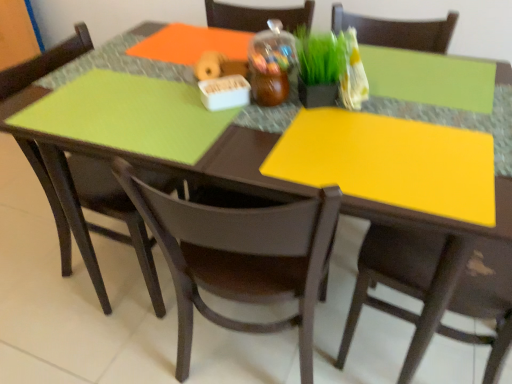
Question: Is matte brown chair at center, the second chair viewed from the right, outside matte black chair at right, acting as the 3th chair starting from the left?

Choices:
 (A) yes
 (B) no

Answer: (A)

Question: Does matte brown chair at center, the second chair viewed from the right, lie behind matte black chair at right, marked as the first chair in a right-to-left arrangement?

Choices:
 (A) no
 (B) yes

Answer: (B)

Question: From the image's perspective, is matte brown chair at center, placed as the 2th chair when sorted from left to right, on matte black chair at right, marked as the first chair in a right-to-left arrangement?

Choices:
 (A) no
 (B) yes

Answer: (B)

Question: Are matte brown chair at center, the second chair viewed from the right, and matte black chair at right, acting as the 3th chair starting from the left, far apart?

Choices:
 (A) no
 (B) yes

Answer: (A)

Question: Considering the relative sizes of matte brown chair at center, placed as the 2th chair when sorted from left to right, and matte black chair at right, acting as the 3th chair starting from the left, in the image provided, is matte brown chair at center, placed as the 2th chair when sorted from left to right, shorter than matte black chair at right, acting as the 3th chair starting from the left,?

Choices:
 (A) no
 (B) yes

Answer: (B)

Question: Is matte brown chair at center, placed as the 2th chair when sorted from left to right, bigger than matte black chair at right, marked as the first chair in a right-to-left arrangement?

Choices:
 (A) yes
 (B) no

Answer: (B)

Question: Is matte brown chair at center, the second chair viewed from the right, at the back of matte black chair at lower left, which is counted as the 3th chair, starting from the right?

Choices:
 (A) no
 (B) yes

Answer: (A)

Question: Can matte brown chair at center, placed as the 2th chair when sorted from left to right, be found inside matte black chair at lower left, which is counted as the 3th chair, starting from the right?

Choices:
 (A) no
 (B) yes

Answer: (A)

Question: Is matte black chair at lower left, which is counted as the 3th chair, starting from the right, positioned before matte brown chair at center, the second chair viewed from the right?

Choices:
 (A) no
 (B) yes

Answer: (A)

Question: From a real-world perspective, is matte black chair at lower left, which is counted as the 3th chair, starting from the right, beneath matte brown chair at center, the second chair viewed from the right?

Choices:
 (A) no
 (B) yes

Answer: (B)

Question: From the image's perspective, is matte black chair at lower left, which is counted as the 3th chair, starting from the right, on matte brown chair at center, the second chair viewed from the right?

Choices:
 (A) yes
 (B) no

Answer: (A)

Question: Can you confirm if matte black chair at right, marked as the first chair in a right-to-left arrangement, is wider than green matte grass at center?

Choices:
 (A) yes
 (B) no

Answer: (A)